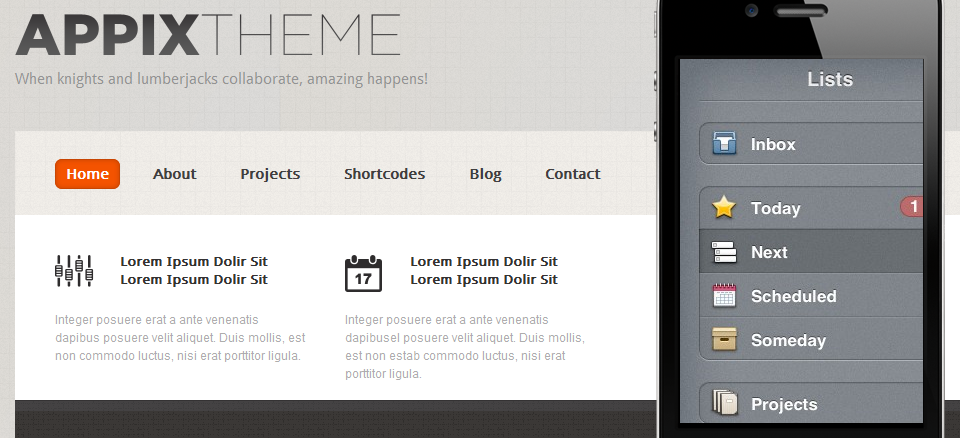
Where is `file box`? The height and width of the screenshot is (438, 960). file box is located at coordinates (721, 343).